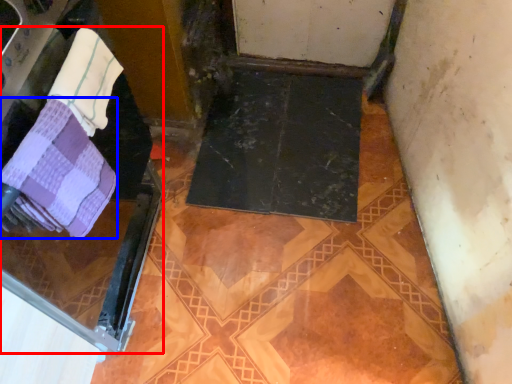
Question: Which object is further to the camera taking this photo, screen door (highlighted by a red box) or towel (highlighted by a blue box)?

Choices:
 (A) screen door
 (B) towel

Answer: (B)